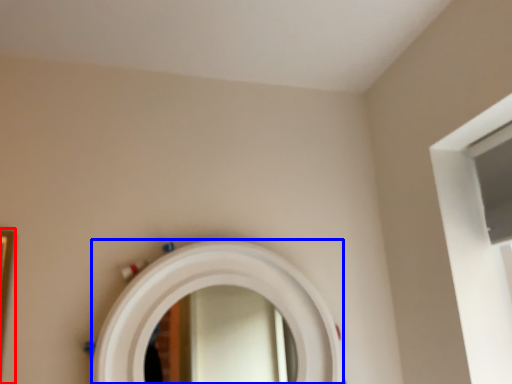
Question: Which object is further to the camera taking this photo, picture frame (highlighted by a red box) or mirror (highlighted by a blue box)?

Choices:
 (A) picture frame
 (B) mirror

Answer: (B)